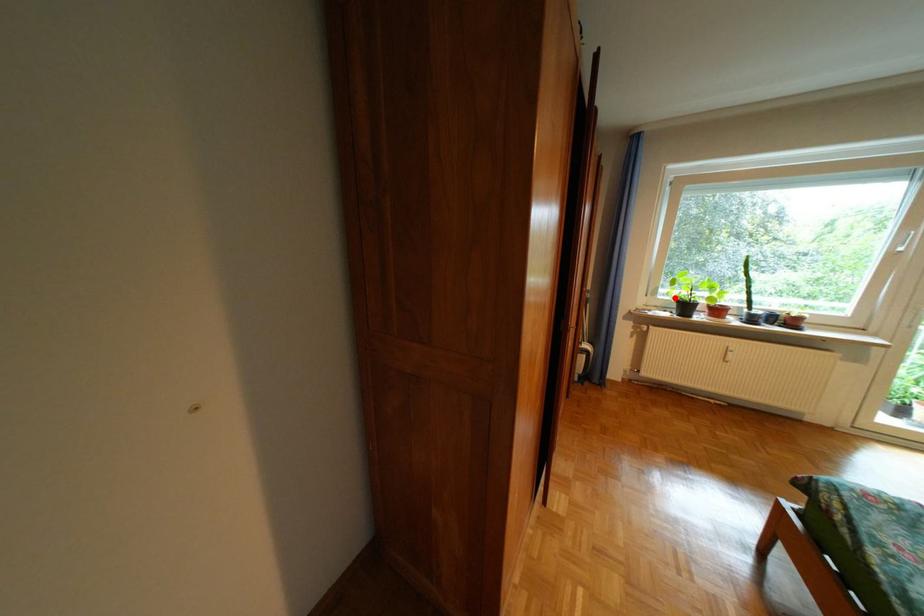
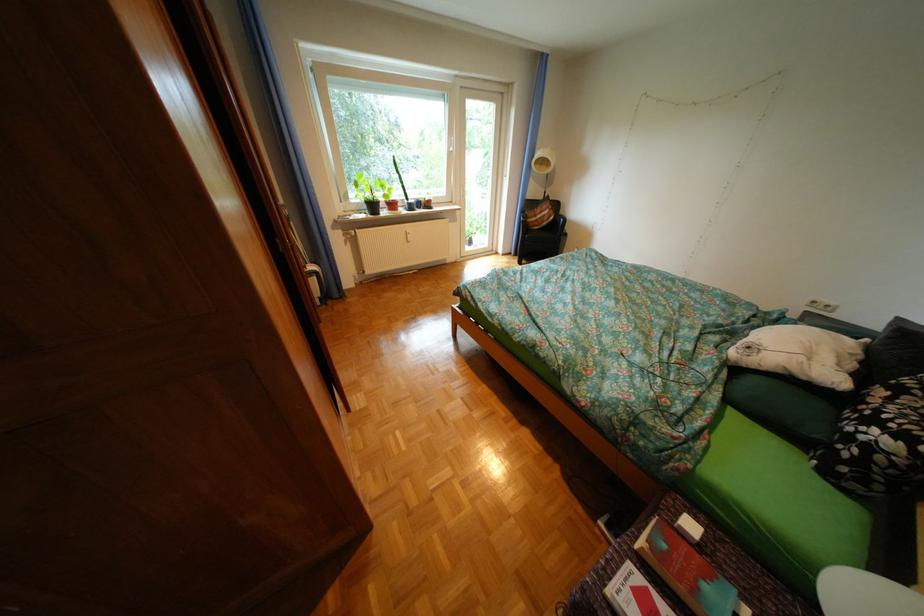
Find the pixel in the second image that matches the highlighted location in the first image.

(368, 201)